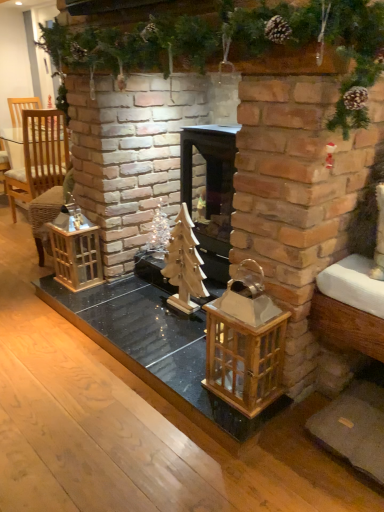
Find the location of `vacant space underneath wooden christmas tree at center (from a real-world perspective)`. vacant space underneath wooden christmas tree at center (from a real-world perspective) is located at coordinates (143, 313).